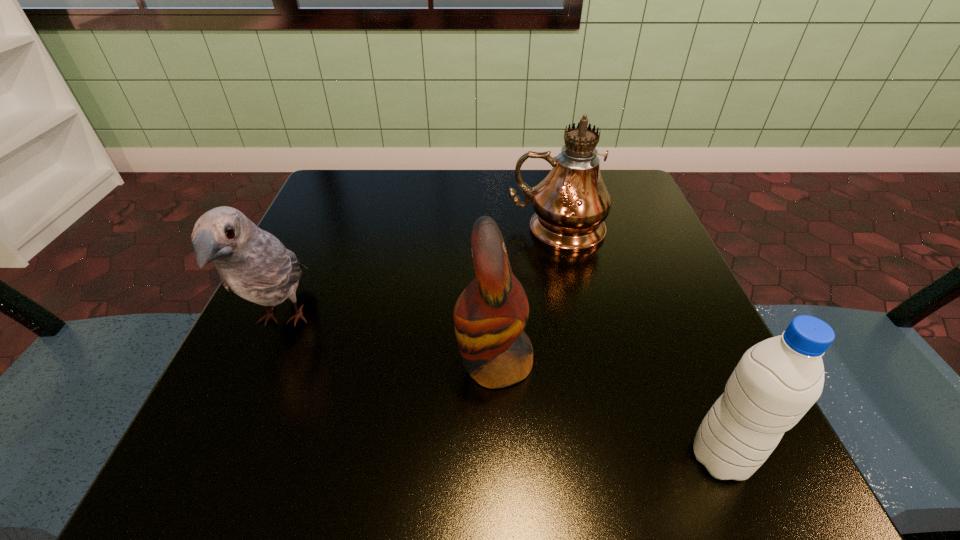
You are a GUI agent. You are given a task and a screenshot of the screen. Output one action in this format:
    pyautogui.click(x=<x>, y=<y>)
    Task: Click on the vacant space at the near edge of the desktop
    
    Given the screenshot: What is the action you would take?
    pyautogui.click(x=577, y=460)

You are a GUI agent. You are given a task and a screenshot of the screen. Output one action in this format:
    pyautogui.click(x=<x>, y=<y>)
    Task: Click on the vacant space at the left edge of the desktop
    
    Given the screenshot: What is the action you would take?
    pyautogui.click(x=365, y=242)

Identify the location of free space at the right edge of the desktop. (654, 392).

What are the coordinates of `free space at the near left corner of the desktop` in the screenshot? It's located at (303, 480).

In the image, there is a desktop. At what (x,y) coordinates should I click in order to perform the action: click on blank space at the far right corner. Please return your answer as a coordinate pair (x, y). The image size is (960, 540). Looking at the image, I should click on (622, 219).

The width and height of the screenshot is (960, 540). Find the location of `unoccupied area between the leftmost object and the water bottle`. unoccupied area between the leftmost object and the water bottle is located at coordinates (501, 389).

At what (x,y) coordinates should I click in order to perform the action: click on vacant space in between the tallest object and the rightmost object. Please return your answer as a coordinate pair (x, y). The height and width of the screenshot is (540, 960). Looking at the image, I should click on (638, 343).

Find the location of `unoccupied position between the rightmost object and the right parrot`. unoccupied position between the rightmost object and the right parrot is located at coordinates (608, 410).

Locate an element on the screen. free space between the water bottle and the right parrot is located at coordinates (608, 410).

Locate an element on the screen. The image size is (960, 540). vacant area between the water bottle and the left parrot is located at coordinates (501, 389).